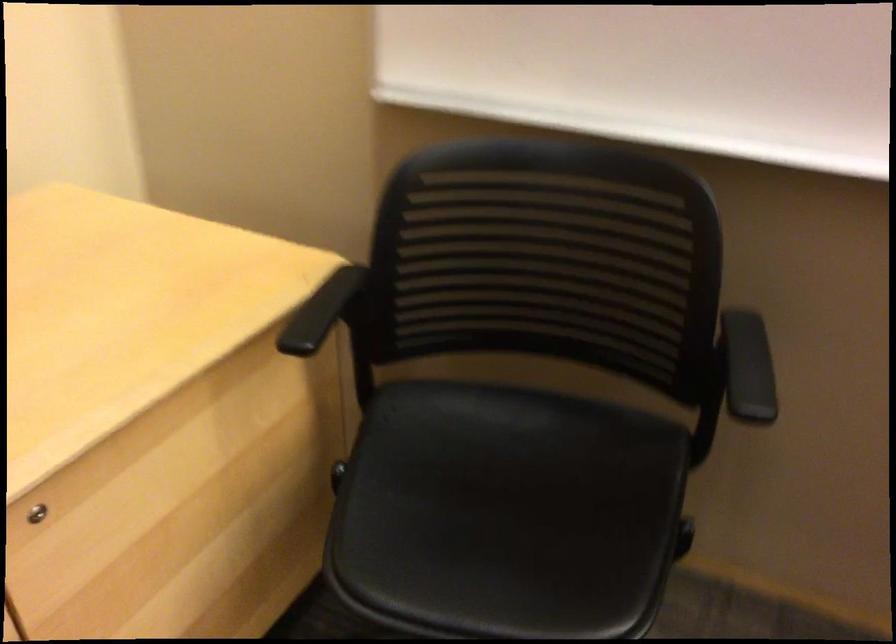
Find where to sit the chair sitting surface. Please return your answer as a coordinate pair (x, y).

(505, 513)